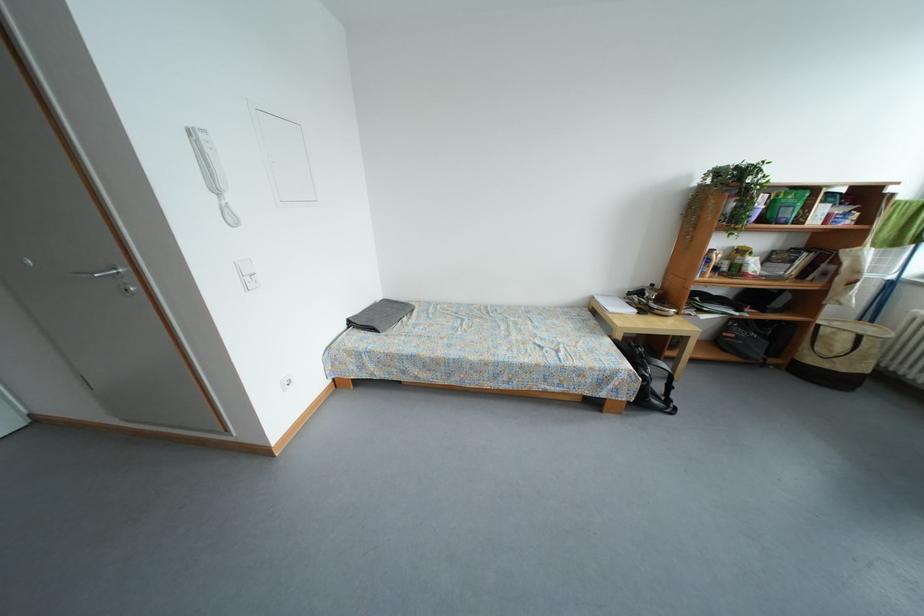
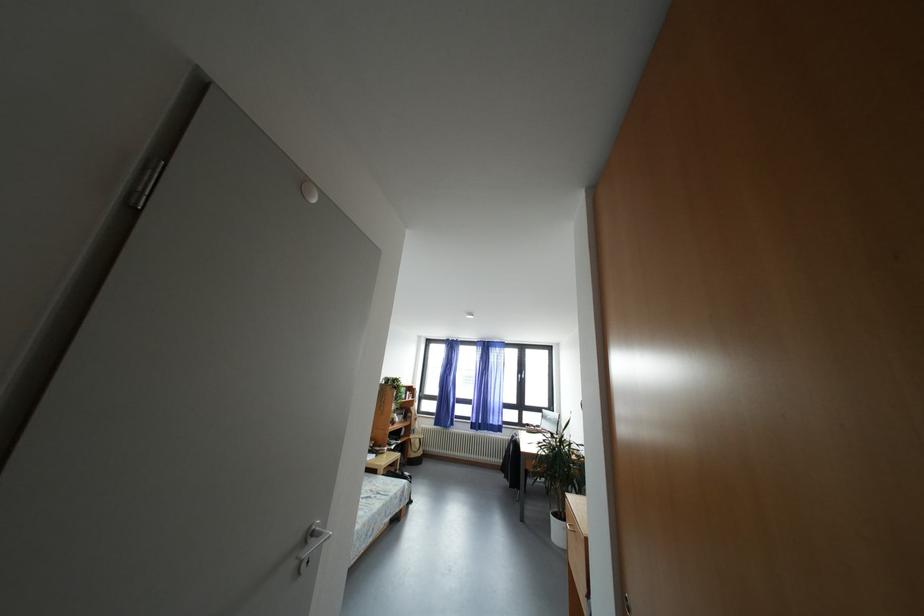
Where in the second image is the point corresponding to the point at 565,349 from the first image?

(378, 496)